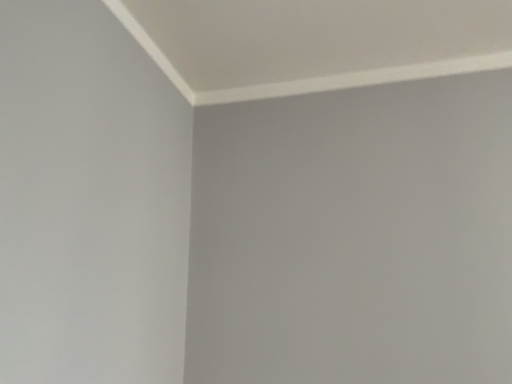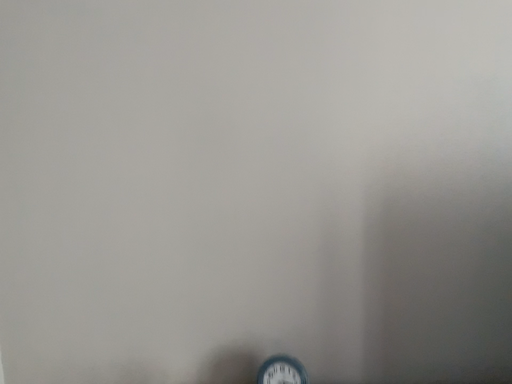
Question: Which way did the camera rotate in the video?

Choices:
 (A) rotated left
 (B) rotated right

Answer: (B)